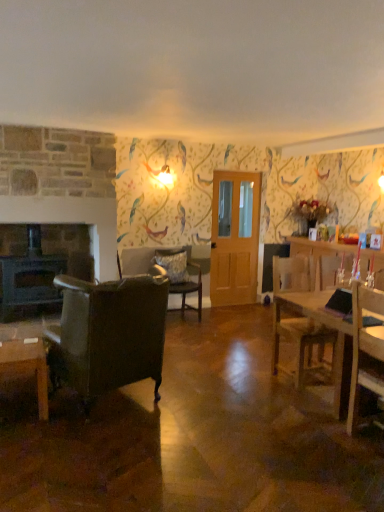
Identify the location of wooden table at right. (327, 327).

Image resolution: width=384 pixels, height=512 pixels. Describe the element at coordinates (301, 341) in the screenshot. I see `wooden chair at right, the 2th chair positioned from the back` at that location.

The image size is (384, 512). What do you see at coordinates (39, 266) in the screenshot?
I see `dark gray stone fireplace at left` at bounding box center [39, 266].

Find the location of a particular element. The height and width of the screenshot is (512, 384). dark gray stone fireplace at left is located at coordinates (39, 266).

Locate an element on the screen. The image size is (384, 512). wooden table at right is located at coordinates (327, 327).

In the scene shown: What's the angular difference between leather armchair at left, arranged as the 3th chair when viewed from the back, and velvet dark green armchair at center, which is counted as the 1th chair, starting from the back,'s facing directions?

159 degrees.

From a real-world perspective, between leather armchair at left, arranged as the 3th chair when viewed from the back, and velvet dark green armchair at center, which appears as the 2th chair when viewed from the right, who is vertically higher?

In real-world perspective, leather armchair at left, arranged as the 3th chair when viewed from the back, is above.

Based on the photo, does leather armchair at left, positioned as the first chair in front-to-back order, have a smaller size compared to velvet dark green armchair at center, which is counted as the 1th chair, starting from the back?

Actually, leather armchair at left, positioned as the first chair in front-to-back order, might be larger than velvet dark green armchair at center, which is counted as the 1th chair, starting from the back.

Locate an element on the screen. chair to the left of velvet dark green armchair at center, marked as the 2th chair in a left-to-right arrangement is located at coordinates (108, 334).

Can you tell me how much fluffy gray pillow at center and dark gray stone fireplace at left differ in facing direction?

The angular difference between fluffy gray pillow at center and dark gray stone fireplace at left is 0.00121 degrees.

Is fluffy gray pillow at center taller than dark gray stone fireplace at left?

No.

Is point (171, 280) positioned in front of point (30, 247)?

Yes, point (171, 280) is closer to viewer.

Does fluffy gray pillow at center have a greater width compared to dark gray stone fireplace at left?

No.

From a real-world perspective, is wooden coffee table at lower left under wooden chair at right, the 2th chair positioned from the back?

Yes, from a real-world perspective, wooden coffee table at lower left is under wooden chair at right, the 2th chair positioned from the back.

Which chair is the 1st one when counting from the back of the wooden coffee table at lower left? Please provide its 2D coordinates.

[(301, 341)]

Is wooden coffee table at lower left located outside wooden chair at right, positioned as the third chair in left-to-right order?

Yes, wooden coffee table at lower left is outside of wooden chair at right, positioned as the third chair in left-to-right order.

Can you confirm if wooden coffee table at lower left is smaller than wooden chair at right, the 2th chair positioned from the back?

Correct, wooden coffee table at lower left occupies less space than wooden chair at right, the 2th chair positioned from the back.

Is velvet dark green armchair at center, positioned as the 3th chair in front-to-back order, positioned beyond the bounds of clear glass door at center?

Yes, velvet dark green armchair at center, positioned as the 3th chair in front-to-back order, is not within clear glass door at center.

What's the angular difference between velvet dark green armchair at center, positioned as the 3th chair in front-to-back order, and clear glass door at center's facing directions?

They differ by 1.77 degrees in their facing directions.

The width and height of the screenshot is (384, 512). In order to click on glass door behind the velvet dark green armchair at center, marked as the 2th chair in a left-to-right arrangement in this screenshot , I will do `click(234, 237)`.

Is velvet dark green armchair at center, positioned as the 3th chair in front-to-back order, in front of clear glass door at center?

Yes, velvet dark green armchair at center, positioned as the 3th chair in front-to-back order, is closer to the camera.

Between wooden chair at right, the 2th chair positioned from the back, and wooden table at right, which one has smaller size?

wooden chair at right, the 2th chair positioned from the back, is smaller.

This screenshot has width=384, height=512. I want to click on desk that is on the right side of wooden chair at right, positioned as the third chair in left-to-right order, so click(327, 327).

Which is behind, point (300, 338) or point (342, 336)?

The point (300, 338) is behind.

Based on the photo, how different are the orientations of wooden chair at right, the 2th chair positioned from the back, and wooden table at right in degrees?

The angle between the facing direction of wooden chair at right, the 2th chair positioned from the back, and the facing direction of wooden table at right is 91.9 degrees.

Is fluffy gray pillow at center in front of or behind leather armchair at left, arranged as the 3th chair when viewed from the right, in the image?

In the image, fluffy gray pillow at center appears behind leather armchair at left, arranged as the 3th chair when viewed from the right.

Is fluffy gray pillow at center inside the boundaries of leather armchair at left, arranged as the 3th chair when viewed from the back, or outside?

fluffy gray pillow at center is not enclosed by leather armchair at left, arranged as the 3th chair when viewed from the back.

From a real-world perspective, is fluffy gray pillow at center above or below leather armchair at left, which is the first chair in left-to-right order?

Clearly, from a real-world perspective, fluffy gray pillow at center is above leather armchair at left, which is the first chair in left-to-right order.

From their relative heights in the image, would you say wooden coffee table at lower left is taller or shorter than clear glass door at center?

Considering their sizes, wooden coffee table at lower left has less height than clear glass door at center.

Between wooden coffee table at lower left and clear glass door at center, which one appears on the right side from the viewer's perspective?

clear glass door at center.

Could you tell me if wooden coffee table at lower left is turned towards clear glass door at center?

No, wooden coffee table at lower left is not oriented towards clear glass door at center.

What's the angular difference between wooden coffee table at lower left and clear glass door at center's facing directions?

They differ by 179 degrees in their facing directions.

From the image's perspective, starting from the velvet dark green armchair at center, which is counted as the 1th chair, starting from the back, which chair is the 2nd one below? Please provide its 2D coordinates.

[(108, 334)]

I want to click on pillow that appears behind the dark gray stone fireplace at left, so click(174, 266).

When comparing their distances from fluffy gray pillow at center, does leather armchair at left, which is the first chair in left-to-right order, or velvet dark green armchair at center, which appears as the 2th chair when viewed from the right, seem closer?

Among the two, velvet dark green armchair at center, which appears as the 2th chair when viewed from the right, is located nearer to fluffy gray pillow at center.

Estimate the real-world distances between objects in this image. Which object is further from wooden coffee table at lower left, velvet dark green armchair at center, marked as the 2th chair in a left-to-right arrangement, or leather armchair at left, positioned as the first chair in front-to-back order?

velvet dark green armchair at center, marked as the 2th chair in a left-to-right arrangement, is positioned further to the anchor wooden coffee table at lower left.

When comparing their distances from wooden chair at right, the 2th chair positioned from the back, does dark gray stone fireplace at left or wooden table at right seem further?

Among the two, dark gray stone fireplace at left is located further to wooden chair at right, the 2th chair positioned from the back.

Estimate the real-world distances between objects in this image. Which object is closer to wooden chair at right, the 2th chair positioned from the back, fluffy gray pillow at center or leather armchair at left, arranged as the 3th chair when viewed from the right?

Based on the image, leather armchair at left, arranged as the 3th chair when viewed from the right, appears to be nearer to wooden chair at right, the 2th chair positioned from the back.

Based on their spatial positions, is dark gray stone fireplace at left or green leafy plant at right further from fluffy gray pillow at center?

Based on the image, green leafy plant at right appears to be further to fluffy gray pillow at center.

From the picture: When comparing their distances from velvet dark green armchair at center, which is counted as the 1th chair, starting from the back, does fluffy gray pillow at center or dark gray stone fireplace at left seem closer?

Based on the image, fluffy gray pillow at center appears to be nearer to velvet dark green armchair at center, which is counted as the 1th chair, starting from the back.

Consider the image. From the image, which object appears to be farther from green leafy plant at right, velvet dark green armchair at center, marked as the 2th chair in a left-to-right arrangement, or wooden table at right?

The object further to green leafy plant at right is wooden table at right.

Based on their spatial positions, is velvet dark green armchair at center, marked as the 2th chair in a left-to-right arrangement, or wooden coffee table at lower left further from wooden chair at right, positioned as the first chair in right-to-left order?

wooden coffee table at lower left is further to wooden chair at right, positioned as the first chair in right-to-left order.

The width and height of the screenshot is (384, 512). What are the coordinates of `pillow between wooden chair at right, positioned as the first chair in right-to-left order, and clear glass door at center from front to back` in the screenshot? It's located at (174, 266).

You are a GUI agent. You are given a task and a screenshot of the screen. Output one action in this format:
    pyautogui.click(x=<x>, y=<y>)
    Task: Click on the pillow between wooden coffee table at lower left and green leafy plant at right from front to back
    
    Given the screenshot: What is the action you would take?
    pyautogui.click(x=174, y=266)

Identify the location of fireplace positioned between leather armchair at left, arranged as the 3th chair when viewed from the right, and velvet dark green armchair at center, marked as the 2th chair in a left-to-right arrangement, from near to far. (39, 266).

Where is `fireplace located between leather armchair at left, arranged as the 3th chair when viewed from the right, and clear glass door at center in the depth direction`? This screenshot has width=384, height=512. fireplace located between leather armchair at left, arranged as the 3th chair when viewed from the right, and clear glass door at center in the depth direction is located at coordinates (39, 266).